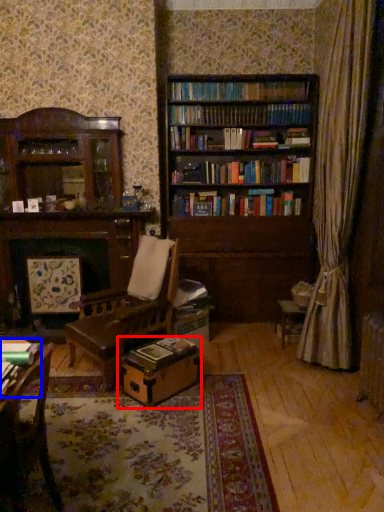
Question: Which point is further to the camera, cardboard box (highlighted by a red box) or book (highlighted by a blue box)?

Choices:
 (A) cardboard box
 (B) book

Answer: (A)